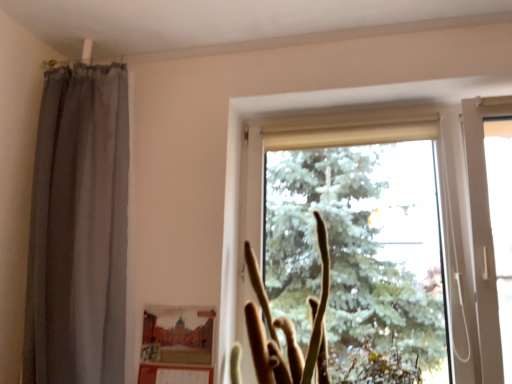
Question: In terms of size, does transparent glass window at center appear bigger or smaller than brown fuzzy plant at center?

Choices:
 (A) small
 (B) big

Answer: (B)

Question: Visually, is transparent glass window at center positioned to the left or to the right of brown fuzzy plant at center?

Choices:
 (A) right
 (B) left

Answer: (A)

Question: Estimate the real-world distances between objects in this image. Which object is farther from the brown fuzzy plant at center?

Choices:
 (A) matte cardboard picture frame at lower center
 (B) transparent glass window at center

Answer: (B)

Question: Considering the real-world distances, which object is closest to the matte cardboard picture frame at lower center?

Choices:
 (A) brown fuzzy plant at center
 (B) transparent glass window at center

Answer: (A)